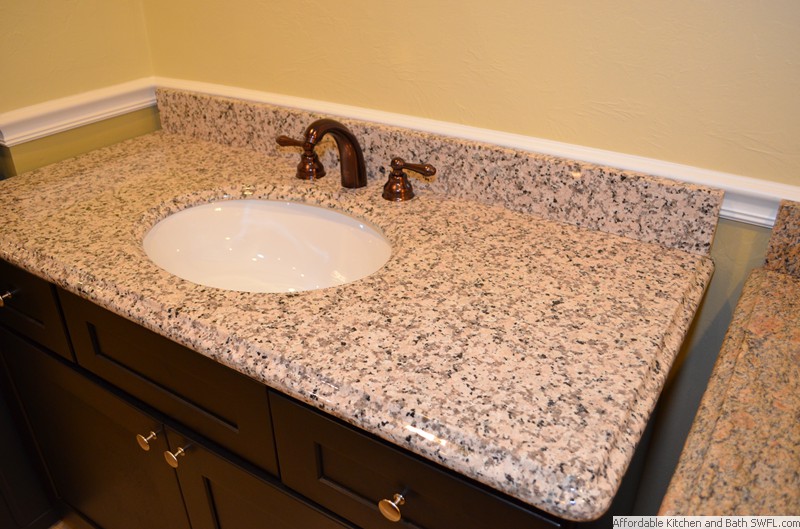
At what (x,y) coordinates should I click in order to perform the action: click on marble counter. Please return your answer as a coordinate pair (x, y). Looking at the image, I should click on (492, 300).